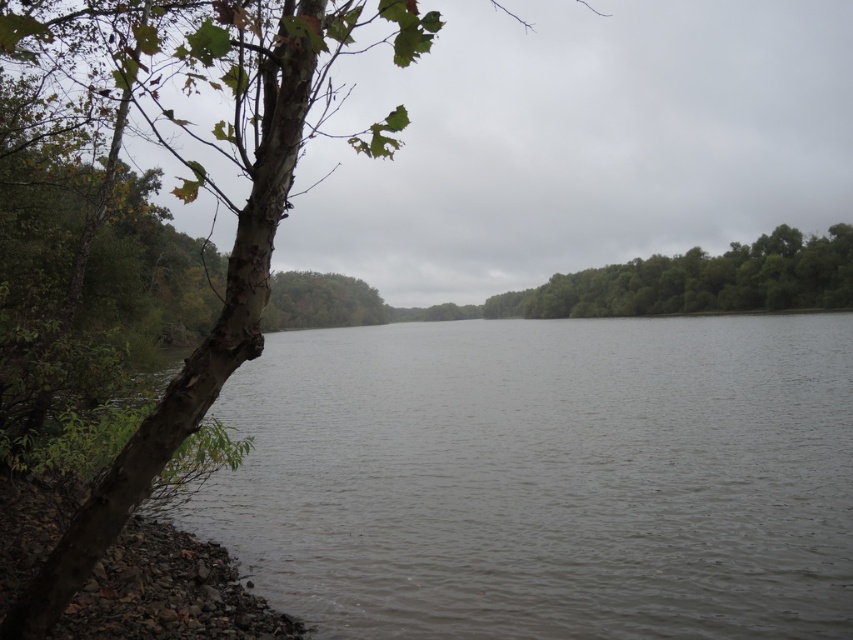
You are standing at the riverside and want to take a photo of the green rough bark tree at left. If your camera can focus on objects up to 15 feet away, will you be able to capture a clear image of the tree?

The green rough bark tree at left is 13.36 feet away from the camera, which is within the camera focus range of up to 15 feet. Therefore, the camera can capture a clear image of the tree.

You are standing at the point marked as point (167, 593) on the riverside. Which direction should you walk to reach the tree branch extending from the bottom left corner towards the center?

The point (167, 593) is on rocks at lower left. The tree branch extends from the bottom left corner towards the center, so you should walk towards the center of the image to reach the tree branch.

You are a hiker who wants to cross the river using the rocks at lower left. However, you notice the green rough bark tree at left nearby. Which object is closer to your current position if you are standing at the riverbank?

The rocks at lower left are closer to your current position because the green rough bark tree at left is positioned on the left side of the rocks at lower left, meaning the rocks are between you and the tree.